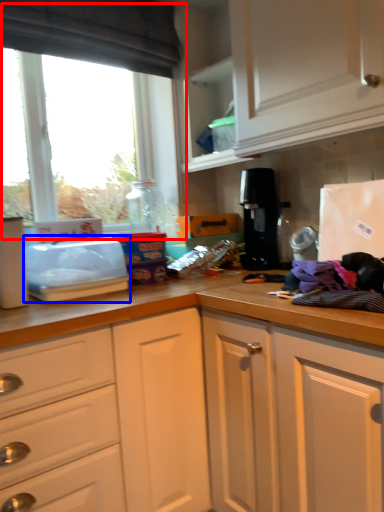
Question: Which object is further to the camera taking this photo, window (highlighted by a red box) or appliance (highlighted by a blue box)?

Choices:
 (A) window
 (B) appliance

Answer: (A)